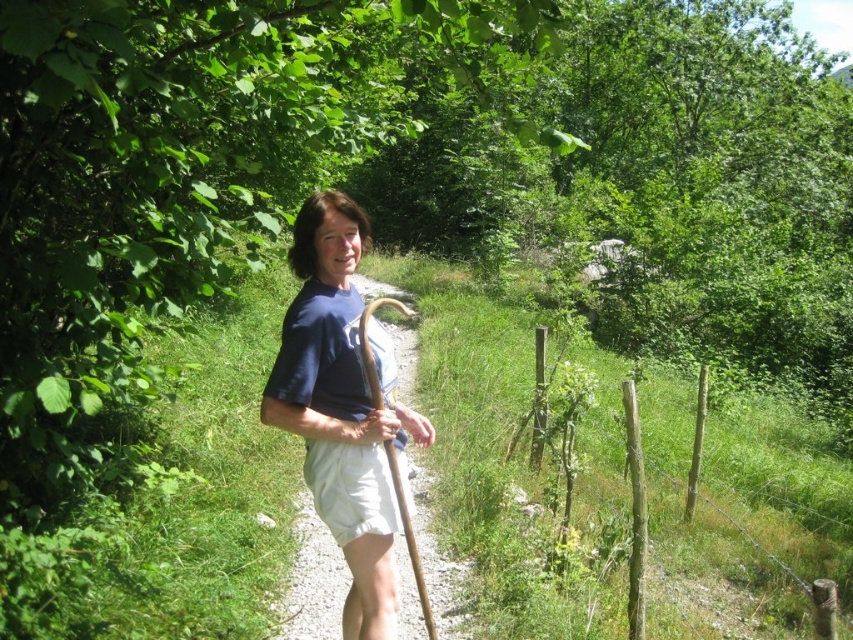
The width and height of the screenshot is (853, 640). Describe the element at coordinates (343, 406) in the screenshot. I see `blue cotton shirt at center` at that location.

Is point (318, 493) farther from viewer compared to point (341, 531)?

Yes.

Is point (321, 394) less distant than point (325, 518)?

Yes, point (321, 394) is in front of point (325, 518).

Find the location of a particular element. Image resolution: width=853 pixels, height=640 pixels. blue cotton shirt at center is located at coordinates tap(343, 406).

Between wooden post at right and white cotton shorts at center, which one has more height?

With more height is white cotton shorts at center.

Between wooden post at right and white cotton shorts at center, which one appears on the right side from the viewer's perspective?

Positioned to the right is wooden post at right.

This screenshot has width=853, height=640. In order to click on wooden post at right in this screenshot , I will do `click(635, 509)`.

Is blue cotton shirt at center above wooden post at right?

Yes, blue cotton shirt at center is above wooden post at right.

Does point (374, 467) come closer to viewer compared to point (636, 483)?

Yes, it is.

Between point (320, 484) and point (643, 630), which one is positioned in front?

Point (320, 484)

Where is `blue cotton shirt at center`? The image size is (853, 640). blue cotton shirt at center is located at coordinates (343, 406).